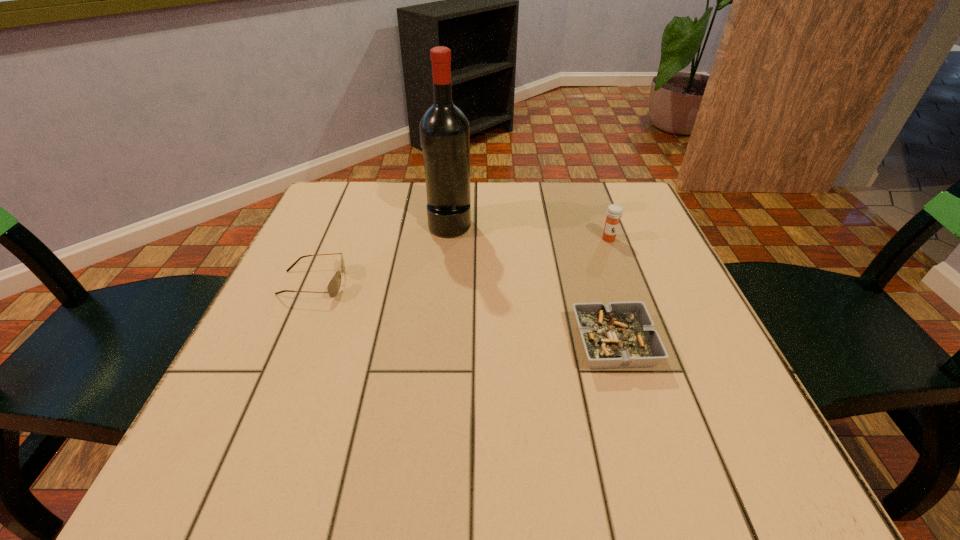
Locate an element on the screen. vacant region between the third shortest object and the wine bottle is located at coordinates (529, 232).

The height and width of the screenshot is (540, 960). I want to click on unoccupied area between the third shortest object and the ashtray, so click(x=612, y=292).

I want to click on object that is the second nearest to the nearest object, so click(444, 129).

Identify the location of object that is the second closest to the second object from left to right. The height and width of the screenshot is (540, 960). (614, 212).

Find the location of a particular element. The image size is (960, 540). free space in the image that satisfies the following two spatial constraints: 1. on the front-facing side of the ashtray; 2. on the left side of the sunglasses is located at coordinates (287, 344).

This screenshot has height=540, width=960. I want to click on free space that satisfies the following two spatial constraints: 1. on the front-facing side of the ashtray; 2. on the left side of the third farthest object, so click(x=287, y=344).

Image resolution: width=960 pixels, height=540 pixels. Find the location of `vacant space that satisfies the following two spatial constraints: 1. on the front-facing side of the sunglasses; 2. on the right side of the ashtray`. vacant space that satisfies the following two spatial constraints: 1. on the front-facing side of the sunglasses; 2. on the right side of the ashtray is located at coordinates (287, 344).

You are a GUI agent. You are given a task and a screenshot of the screen. Output one action in this format:
    pyautogui.click(x=<x>, y=<y>)
    Task: Click on the vacant region that satisfies the following two spatial constraints: 1. on the front-facing side of the second nearest object; 2. on the back side of the ashtray
    
    Given the screenshot: What is the action you would take?
    pyautogui.click(x=287, y=344)

The image size is (960, 540). What are the coordinates of `vacant area in the image that satisfies the following two spatial constraints: 1. on the label side of the medicine; 2. on the front-facing side of the sunglasses` in the screenshot? It's located at tap(625, 283).

Find the location of a particular element. Image resolution: width=960 pixels, height=540 pixels. free point that satisfies the following two spatial constraints: 1. on the label side of the medicine; 2. on the front-facing side of the sunglasses is located at coordinates (625, 283).